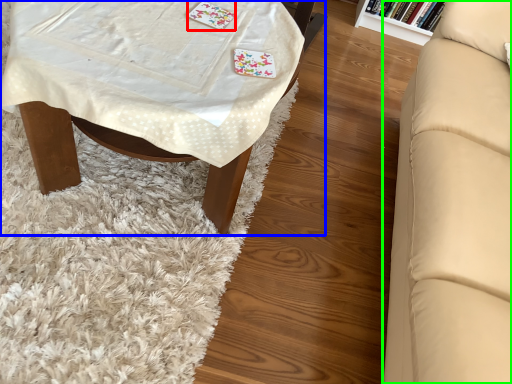
Question: Which object is the closest to the card game (highlighted by a red box)? Choose among these: table (highlighted by a blue box) or studio couch (highlighted by a green box).

Choices:
 (A) table
 (B) studio couch

Answer: (A)